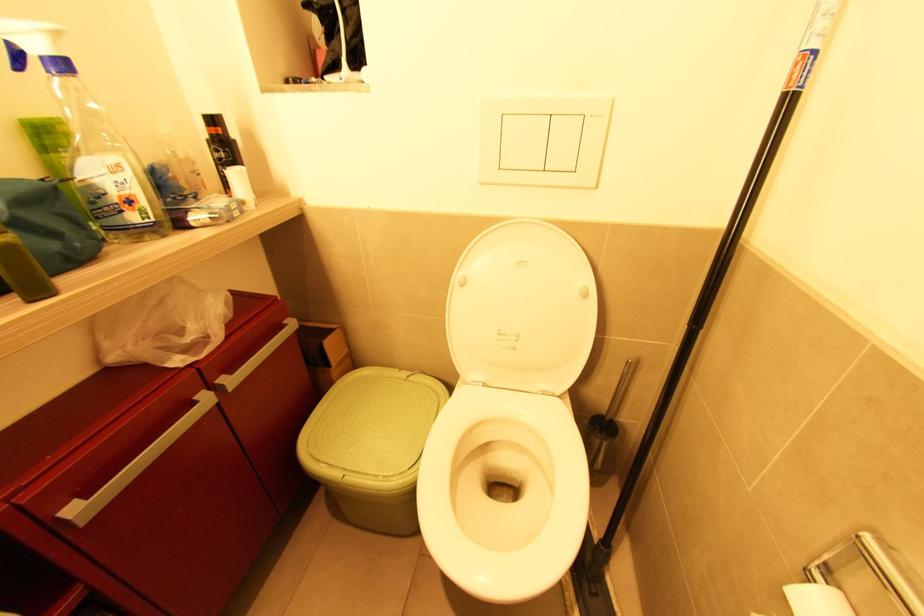
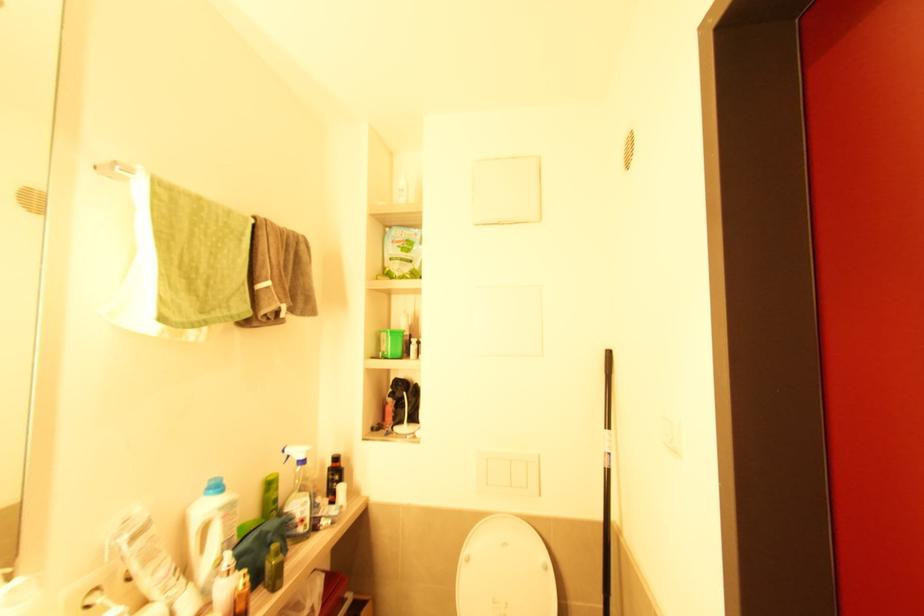
Where in the second image is the point corresponding to (x=124, y=213) from the first image?

(298, 527)